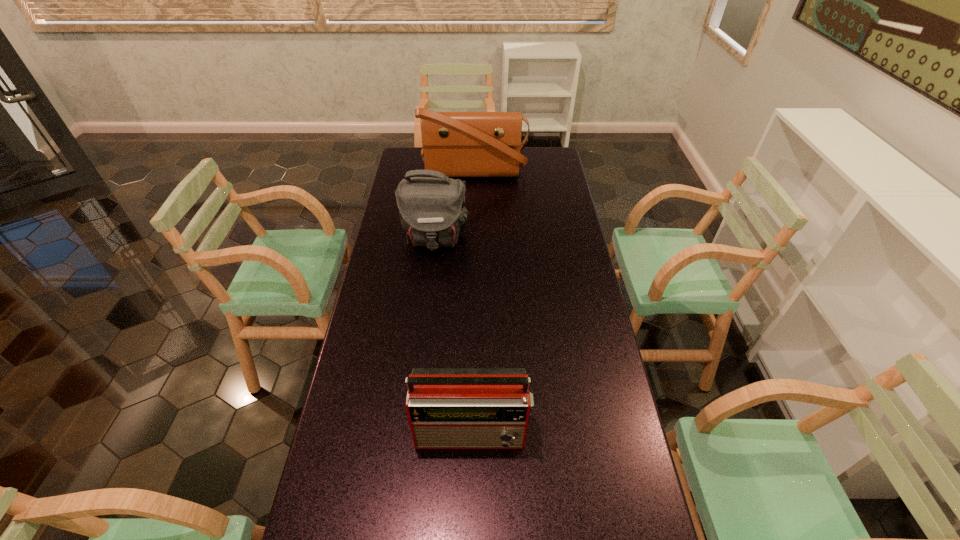
You are a GUI agent. You are given a task and a screenshot of the screen. Output one action in this format:
    pyautogui.click(x=<x>, y=<y>)
    Task: Click on the farthest object
    The width and height of the screenshot is (960, 540).
    Given the screenshot: What is the action you would take?
    pyautogui.click(x=458, y=144)

Image resolution: width=960 pixels, height=540 pixels. I want to click on the second nearest object, so click(432, 212).

This screenshot has width=960, height=540. What are the coordinates of `radio receiver` in the screenshot? It's located at point(448,408).

This screenshot has height=540, width=960. Identify the location of vacant space located on the front flap of the satchel. (472, 239).

The width and height of the screenshot is (960, 540). Find the location of `vacant space located on the open flap of the second nearest object`. vacant space located on the open flap of the second nearest object is located at coordinates (427, 305).

The image size is (960, 540). I want to click on free space located 0.060m on the front-facing side of the nearest object, so click(x=472, y=476).

At what (x,y) coordinates should I click in order to perform the action: click on object that is at the far edge. Please return your answer as a coordinate pair (x, y). This screenshot has width=960, height=540. Looking at the image, I should click on (458, 144).

Where is `satchel present at the left edge`? satchel present at the left edge is located at coordinates (458, 144).

Locate an element on the screen. shoulder bag present at the left edge is located at coordinates (432, 212).

The image size is (960, 540). I want to click on object present at the far left corner, so click(458, 144).